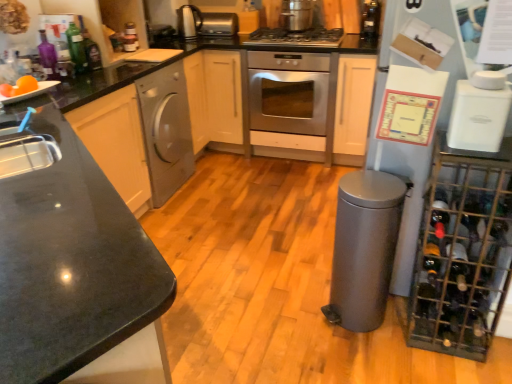
You are a GUI agent. You are given a task and a screenshot of the screen. Output one action in this format:
    pyautogui.click(x=<x>, y=<y>)
    Task: Click on the free space in front of stainless steel pot at upper center, which is counted as the 1th kitchen appliance, starting from the top
    This screenshot has width=512, height=384.
    Given the screenshot: What is the action you would take?
    pyautogui.click(x=297, y=39)